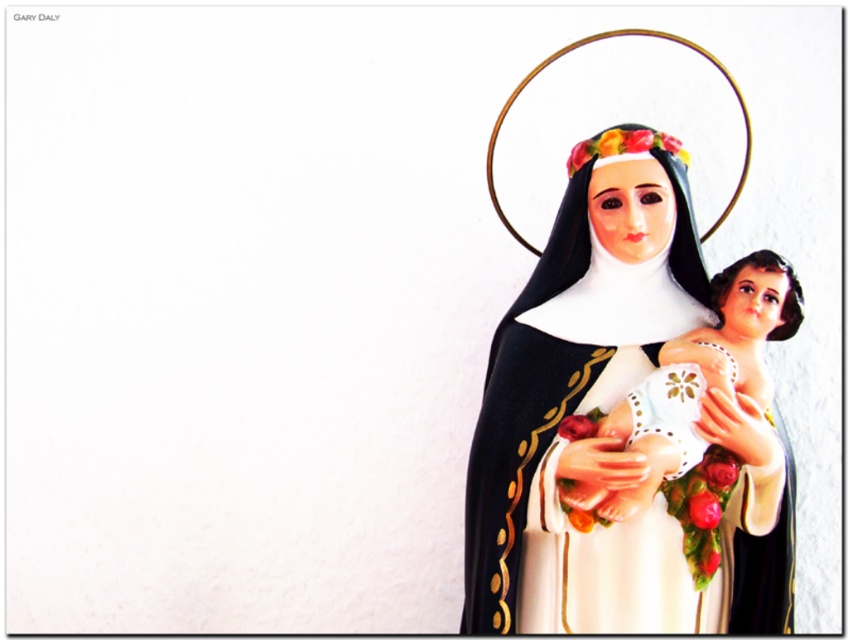
You are standing in front of the statue of the nun holding a baby. The statue is located at point [640,371]. If you want to place a bouquet of flowers exactly 4 feet away from the statue, will you be able to do so?

The distance between point [640,371] and the viewer is 3.88 feet. Since you want to place the bouquet 4 feet away, you can step back slightly to achieve the desired distance.

You are an art conservator examining the statue of the nun and the baby. You need to determine the placement of the matte porcelain statue at right relative to the white lace baby at center. Is the statue positioned above or below the baby?

The matte porcelain statue at right is above the white lace baby at center.